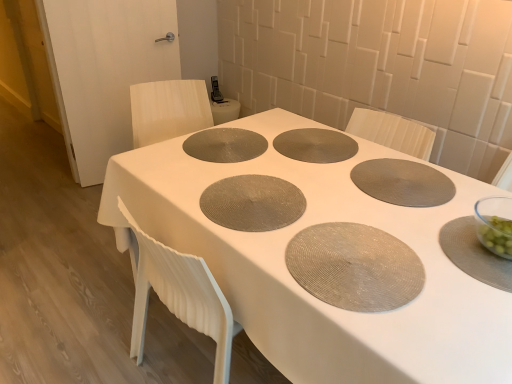
You are a GUI agent. You are given a task and a screenshot of the screen. Output one action in this format:
    pyautogui.click(x=<x>, y=<y>)
    Task: Click on the vacant space to the right of matte gray placemat at center, which is counted as the second oval, starting from the right
    This screenshot has width=512, height=384.
    Given the screenshot: What is the action you would take?
    pyautogui.click(x=295, y=145)